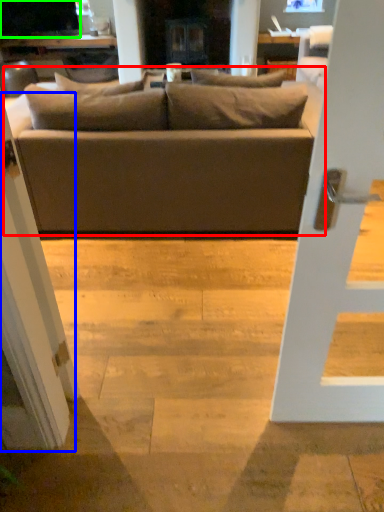
Question: Estimate the real-world distances between objects in this image. Which object is farther from studio couch (highlighted by a red box), screen door (highlighted by a blue box) or dark (highlighted by a green box)?

Choices:
 (A) screen door
 (B) dark

Answer: (B)